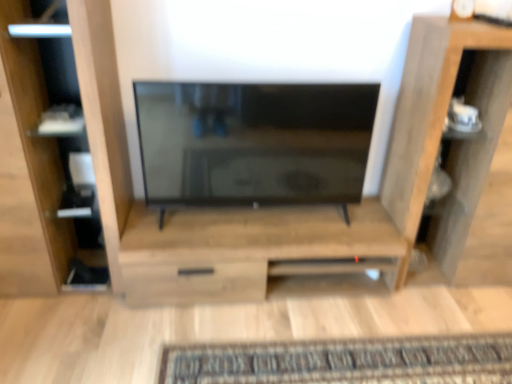
Locate an element on the screen. The image size is (512, 384). matte wood shelf at left is located at coordinates (61, 140).

The image size is (512, 384). What do you see at coordinates (254, 142) in the screenshot?
I see `matte black tv at center` at bounding box center [254, 142].

You are a GUI agent. You are given a task and a screenshot of the screen. Output one action in this format:
    pyautogui.click(x=<x>, y=<y>)
    Task: Click on the matte wood shelf at left
    This screenshot has width=512, height=384.
    Given the screenshot: What is the action you would take?
    pyautogui.click(x=61, y=140)

Between point (176, 89) and point (475, 37), which one is positioned in front?

Point (475, 37)

This screenshot has height=384, width=512. I want to click on screen above the wooden shelf at right (from the image's perspective), so click(x=254, y=142).

Considering the relative positions of matte black tv at center and wooden shelf at right in the image provided, is matte black tv at center to the right of wooden shelf at right from the viewer's perspective?

No, matte black tv at center is not to the right of wooden shelf at right.

Could you tell me if matte black tv at center is turned towards wooden shelf at right?

No, matte black tv at center is not aimed at wooden shelf at right.

Between wooden cabinet at center and wooden shelf at right, which one has larger size?

Bigger between the two is wooden shelf at right.

How different are the orientations of wooden cabinet at center and wooden shelf at right in degrees?

The angular difference between wooden cabinet at center and wooden shelf at right is 0.000429 degrees.

Considering the relative sizes of wooden cabinet at center and wooden shelf at right in the image provided, is wooden cabinet at center shorter than wooden shelf at right?

Indeed, wooden cabinet at center has a lesser height compared to wooden shelf at right.

Considering the points (296, 231) and (410, 161), which point is in front, point (296, 231) or point (410, 161)?

Positioned in front is point (410, 161).

Is matte black tv at center looking in the opposite direction of matte wood shelf at left?

No, matte black tv at center is not facing away from matte wood shelf at left.

Which of these two, matte black tv at center or matte wood shelf at left, is wider?

matte wood shelf at left.

Is point (324, 126) closer to viewer compared to point (29, 120)?

No, it is behind (29, 120).

Locate an element on the screen. The image size is (512, 384). furniture in front of the matte black tv at center is located at coordinates (61, 140).

Which is behind, point (121, 167) or point (252, 138)?

The point (121, 167) is farther.

Which object is wider, matte wood shelf at left or matte black tv at center?

matte wood shelf at left.

How different are the orientations of matte wood shelf at left and matte black tv at center in degrees?

matte wood shelf at left and matte black tv at center are facing 0.423 degrees away from each other.

From the image's perspective, which object appears higher, matte wood shelf at left or matte black tv at center?

From the image's view, matte black tv at center is above.

I want to click on shelf behind the matte wood shelf at left, so [442, 127].

Is matte wood shelf at left at the back of wooden shelf at right?

wooden shelf at right is not turned away from matte wood shelf at left.

Is wooden shelf at right bigger than matte wood shelf at left?

Yes.

Does point (440, 82) come closer to viewer compared to point (14, 54)?

No, (440, 82) is behind (14, 54).

Is wooden cabinet at center at the right side of matte wood shelf at left?

Yes, wooden cabinet at center is to the right of matte wood shelf at left.

Is wooden cabinet at center not near matte wood shelf at left?

That's not correct — wooden cabinet at center is a little close to matte wood shelf at left.

From the image's perspective, is wooden cabinet at center located above matte wood shelf at left?

No, from the image's perspective, wooden cabinet at center is not over matte wood shelf at left.

How distant is matte wood shelf at left from wooden shelf at right?

matte wood shelf at left and wooden shelf at right are 4.45 feet apart.

Does point (28, 115) come farther from viewer compared to point (482, 99)?

No, it is not.

From their relative heights in the image, would you say matte wood shelf at left is taller or shorter than wooden shelf at right?

In the image, matte wood shelf at left appears to be taller than wooden shelf at right.

From a real-world perspective, is matte wood shelf at left beneath wooden shelf at right?

No, from a real-world perspective, matte wood shelf at left is not beneath wooden shelf at right.

This screenshot has width=512, height=384. Find the location of `shelf below the matte black tv at center (from the image's perspective)`. shelf below the matte black tv at center (from the image's perspective) is located at coordinates (442, 127).

Find the location of a particular element. Image resolution: width=512 pixels, height=384 pixels. shelf above the wooden cabinet at center (from a real-world perspective) is located at coordinates (442, 127).

Estimate the real-world distances between objects in this image. Which object is closer to wooden cabinet at center, matte wood shelf at left or wooden shelf at right?

matte wood shelf at left is positioned closer to the anchor wooden cabinet at center.

Considering their positions, is wooden shelf at right positioned further to matte black tv at center than matte wood shelf at left?

wooden shelf at right is positioned further to the anchor matte black tv at center.

Looking at the image, which one is located further to wooden cabinet at center, wooden shelf at right or matte black tv at center?

wooden shelf at right is positioned further to the anchor wooden cabinet at center.

Which object lies further to the anchor point wooden shelf at right, matte wood shelf at left or matte black tv at center?

matte wood shelf at left lies further to wooden shelf at right than the other object.

Which object lies further to the anchor point wooden shelf at right, matte wood shelf at left or wooden cabinet at center?

matte wood shelf at left is further to wooden shelf at right.

Based on their spatial positions, is matte black tv at center or wooden cabinet at center further from matte wood shelf at left?

wooden cabinet at center lies further to matte wood shelf at left than the other object.

Which object lies nearer to the anchor point wooden cabinet at center, wooden shelf at right or matte wood shelf at left?

Based on the image, matte wood shelf at left appears to be nearer to wooden cabinet at center.

From the image, which object appears to be nearer to matte black tv at center, wooden cabinet at center or matte wood shelf at left?

wooden cabinet at center.

Identify the location of screen between wooden cabinet at center and wooden shelf at right. The height and width of the screenshot is (384, 512). (254, 142).

Where is `screen between matte wood shelf at left and wooden shelf at right`? The height and width of the screenshot is (384, 512). screen between matte wood shelf at left and wooden shelf at right is located at coordinates pos(254,142).

At what (x,y) coordinates should I click in order to perform the action: click on cabinetry between matte wood shelf at left and matte black tv at center from left to right. Please return your answer as a coordinate pair (x, y). Looking at the image, I should click on (250, 249).

I want to click on cabinetry located between matte wood shelf at left and wooden shelf at right in the left-right direction, so click(x=250, y=249).